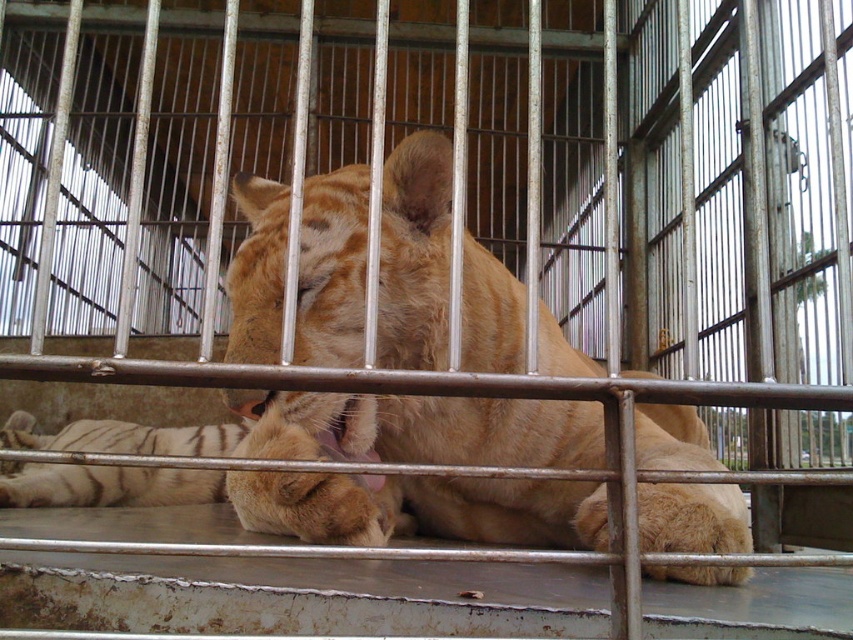
You are a zookeeper checking the tiger enclosure. You notice the orange fur tiger at center and the white striped fur at lower left. Which object is closer to you in the enclosure?

The orange fur tiger at center is closer to you than the white striped fur at lower left because it is in front of it.